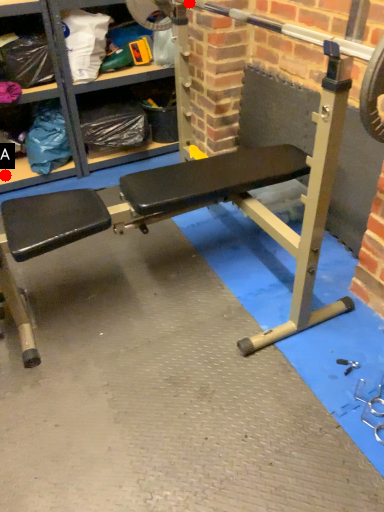
Question: Two points are circled on the image, labeled by A and B beside each circle. Which point is further to the camera?

Choices:
 (A) A is further
 (B) B is further

Answer: (A)